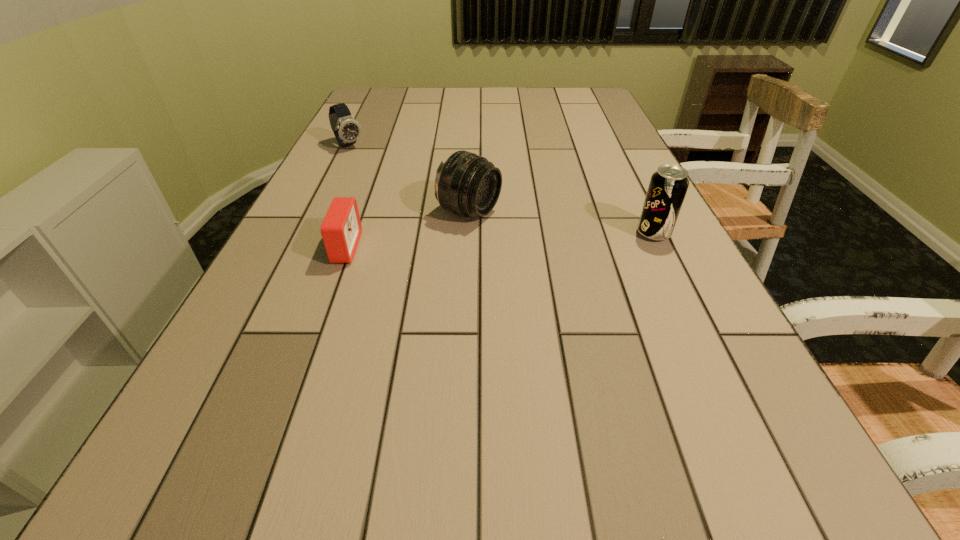
In the image, there is a desktop. Identify the location of vacant space at the right edge. This screenshot has width=960, height=540. (573, 133).

Find the location of a particular element. Image resolution: width=960 pixels, height=540 pixels. vacant area at the far left corner is located at coordinates (373, 100).

Find the location of a particular element. Image resolution: width=960 pixels, height=540 pixels. empty space that is in between the telephoto lens and the third object from right to left is located at coordinates (407, 230).

Locate an element on the screen. free space between the farthest object and the second object from right to left is located at coordinates (409, 179).

Locate an element on the screen. The height and width of the screenshot is (540, 960). empty location between the leftmost object and the third object from left to right is located at coordinates (409, 179).

Locate an element on the screen. vacant point located between the alarm clock and the rightmost object is located at coordinates (499, 241).

Where is `empty space between the alarm clock and the rightmost object`? This screenshot has height=540, width=960. empty space between the alarm clock and the rightmost object is located at coordinates click(x=499, y=241).

Find the location of a particular element. vacant area that lies between the second object from left to right and the third object from left to right is located at coordinates (407, 230).

I want to click on vacant area that lies between the rightmost object and the third object from right to left, so click(499, 241).

In order to click on vacant space in between the telephoto lens and the watch in this screenshot , I will do `click(409, 179)`.